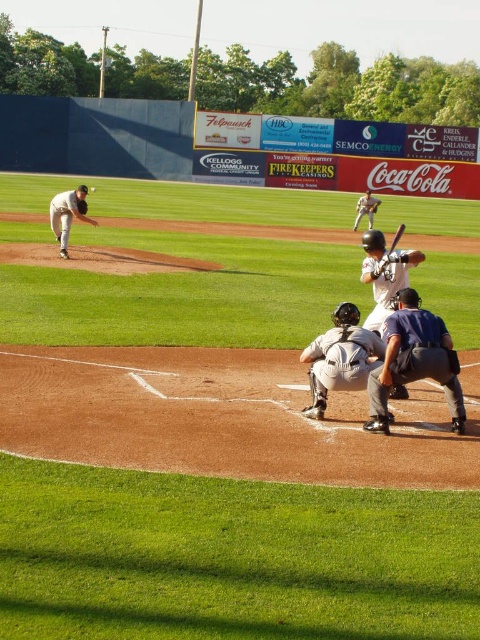
You are a groundskeeper who needs to place a new bench between the white jersey baseball player at center and the dark gray leather glove at left. The bench is 1.5 meters long. Can you fit the bench between them without moving either object?

The distance between the white jersey baseball player at center and the dark gray leather glove at left is 13.08 meters. Since the bench is only 1.5 meters long, there is more than enough space to place it between them without moving either object.

You are a baseball player standing at home plate, and you want to throw a ball to a teammate positioned at point (362, 204). However, there is an obstacle at point (78, 202). Based on the spatial relationship between these two points, can you directly throw the ball to your teammate without the ball passing over the obstacle?

Point (362, 204) is behind point (78, 202), so the ball would have to go over the obstacle at point (78, 202) to reach your teammate.

Looking at this image, you are standing at the pitcher position near home plate and want to throw a ball to a point closer to you in the outfield. Which point should you aim for, point (x=386, y=346) or point (x=312, y=378)?

You should aim for point (x=386, y=346) because it is closer to the viewer than point (x=312, y=378).